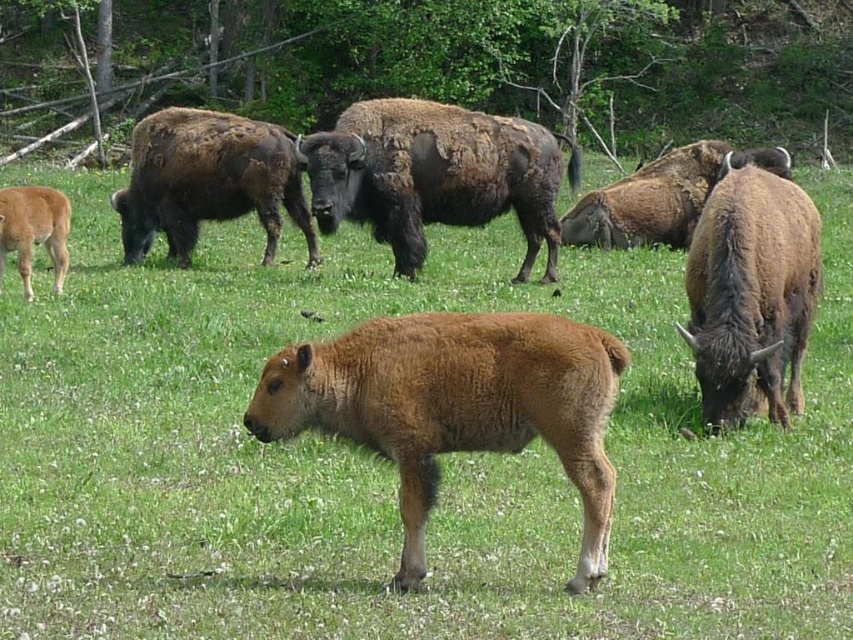
You are a wildlife photographer trying to capture a photo of the brown furry calf at center and the brown fuzzy bison at right. You want to ensure both subjects are visible in the frame. Given their sizes, which animal should you focus on to ensure they both fit in the photo?

The brown furry calf at center is larger than the brown fuzzy bison at right. To ensure both fit in the frame, focus on the brown furry calf at center since it is the larger subject and adjusting the camera angle to include it will naturally accommodate the smaller bison.

You are a wildlife photographer trying to capture a photo of the brown furry calf at center and the brown shaggy bison at center. Based on their body thickness, which one would you need to position your camera closer to in order to ensure both subjects are in focus?

The brown furry calf at center is thinner than the brown shaggy bison at center, so you need to position your camera closer to the brown furry calf at center to ensure both are in focus.